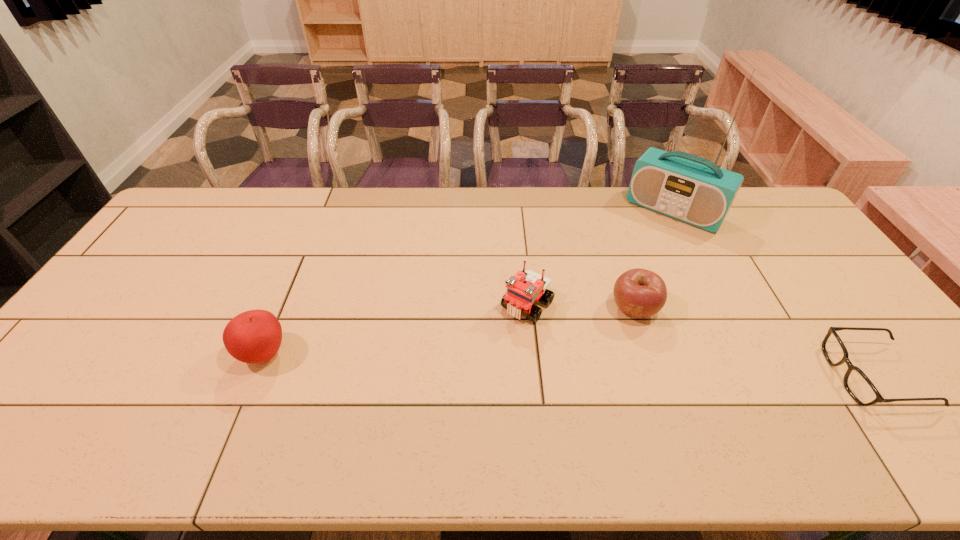
The width and height of the screenshot is (960, 540). I want to click on blank space located 0.270m on the front-facing side of the Lego, so click(x=454, y=395).

At what (x,y) coordinates should I click in order to perform the action: click on vacant space located on the front-facing side of the Lego. Please return your answer as a coordinate pair (x, y). The width and height of the screenshot is (960, 540). Looking at the image, I should click on (487, 355).

This screenshot has width=960, height=540. I want to click on object present at the far edge, so coord(686,187).

Find the location of a particular element. object at the near edge is located at coordinates (857, 384).

Image resolution: width=960 pixels, height=540 pixels. Find the location of `object that is at the right edge`. object that is at the right edge is located at coordinates (857, 384).

This screenshot has height=540, width=960. What are the coordinates of `object positioned at the near right corner` in the screenshot? It's located at (857, 384).

I want to click on free space at the far edge of the desktop, so click(337, 193).

I want to click on free space at the near edge, so click(114, 379).

This screenshot has height=540, width=960. Identify the location of vacant space at the left edge of the desktop. (156, 289).

I want to click on vacant space at the right edge, so click(857, 314).